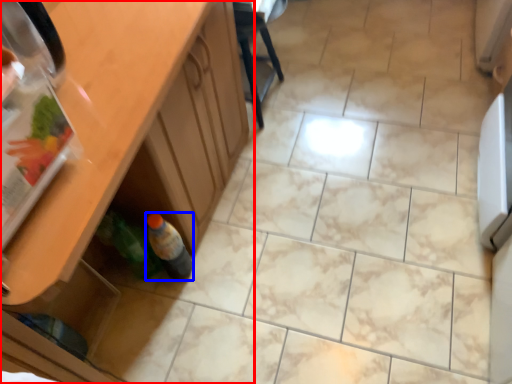
Question: Which of the following is the closest to the observer, cabinetry (highlighted by a red box) or bottle (highlighted by a blue box)?

Choices:
 (A) cabinetry
 (B) bottle

Answer: (A)